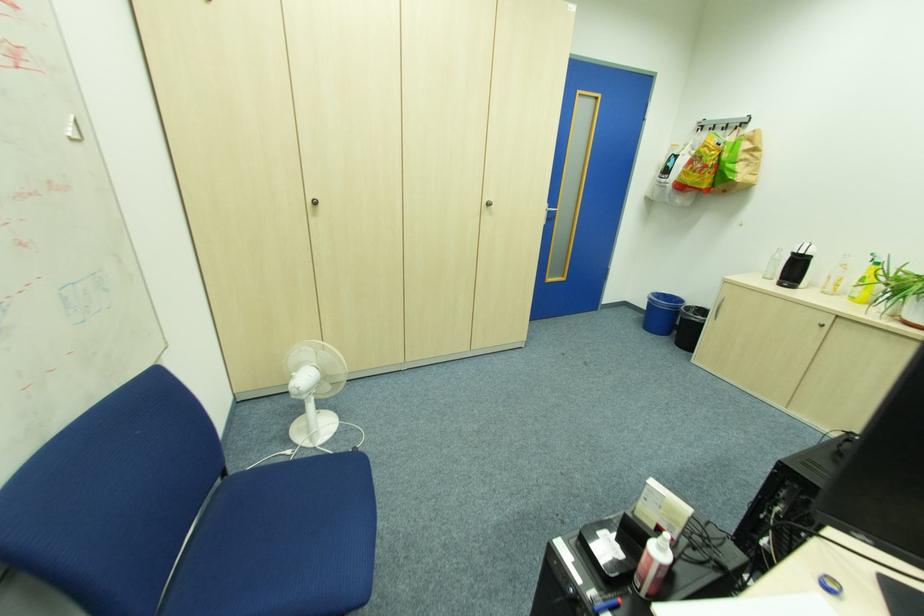
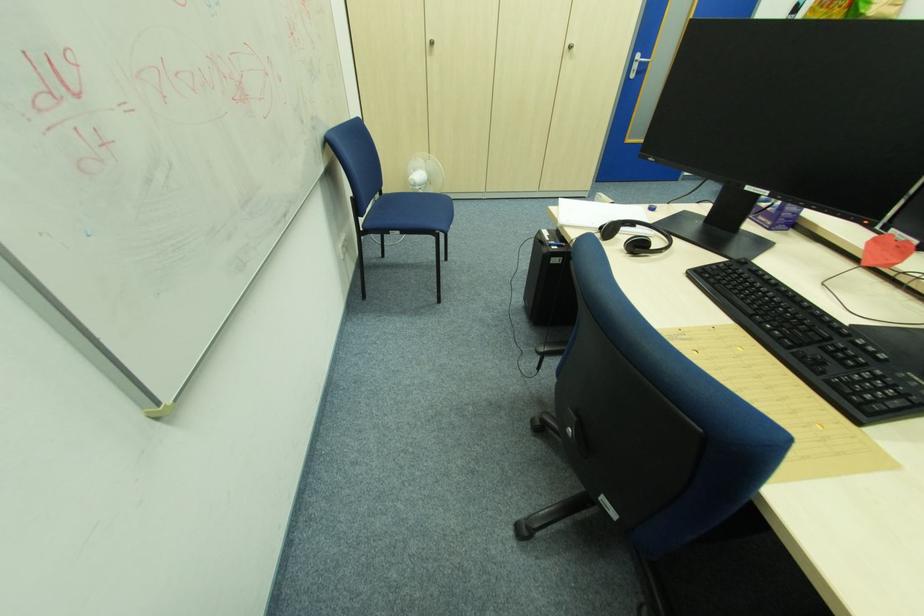
Find the pixel in the second image that matches (x=490, y=205) in the first image.

(572, 47)